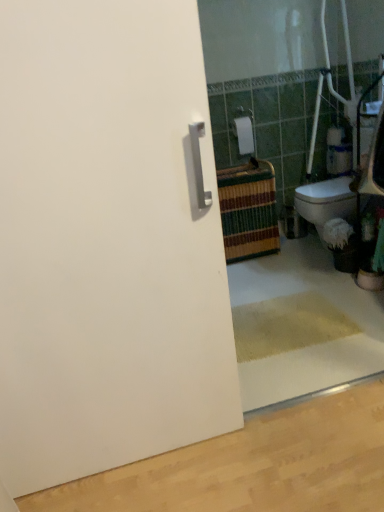
The image size is (384, 512). Identify the location of free space below white matte door at left (from a real-world perspective). (140, 462).